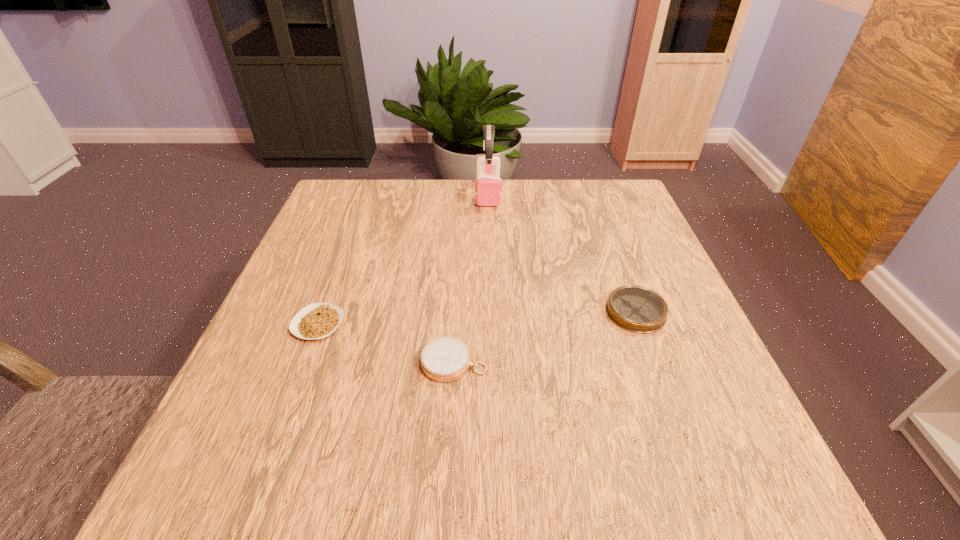
This screenshot has width=960, height=540. In order to click on free spot between the tallest object and the legume in this screenshot , I will do `click(403, 259)`.

Choose which object is the second nearest neighbor to the leftmost object. Please provide its 2D coordinates. Your answer should be formatted as a tuple, i.e. [(x, y)], where the tuple contains the x and y coordinates of a point satisfying the conditions above.

[(488, 187)]

At what (x,y) coordinates should I click in order to perform the action: click on object that stands as the second closest to the rightmost object. Please return your answer as a coordinate pair (x, y). Looking at the image, I should click on (488, 187).

Locate an element on the screen. The height and width of the screenshot is (540, 960). free space that satisfies the following two spatial constraints: 1. on the outer surface of the tallest object; 2. on the right side of the farther compass is located at coordinates (492, 312).